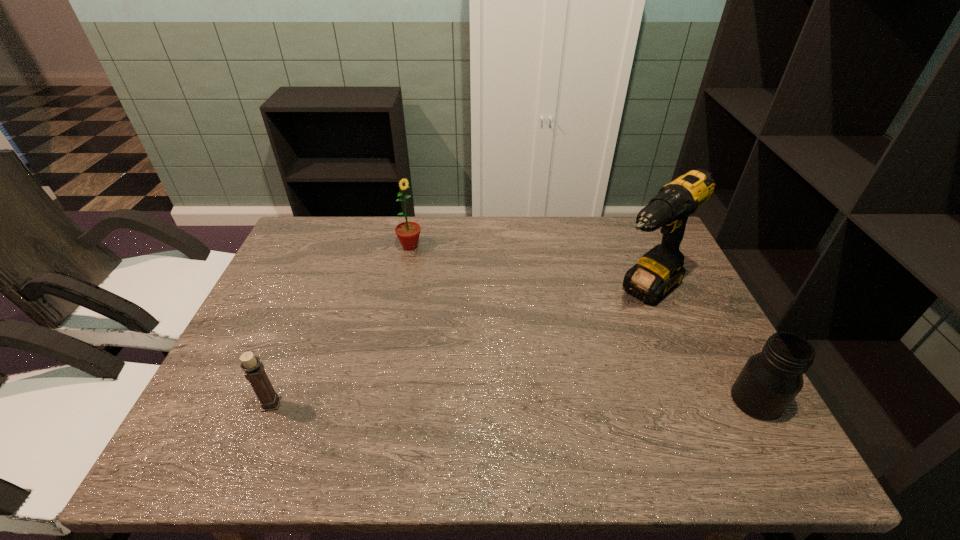
I want to click on candle holder, so click(x=254, y=370).

Locate an element on the screen. jar is located at coordinates (770, 380).

The width and height of the screenshot is (960, 540). I want to click on drill, so click(659, 271).

Where is `the tallest object`? The height and width of the screenshot is (540, 960). the tallest object is located at coordinates pyautogui.click(x=659, y=271).

Where is `sunflower`? The width and height of the screenshot is (960, 540). sunflower is located at coordinates (408, 233).

Find the location of a particular element. The height and width of the screenshot is (540, 960). the farthest object is located at coordinates (408, 233).

Locate an element on the screen. This screenshot has height=540, width=960. free spot located 0.370m on the right of the candle holder is located at coordinates (451, 404).

Find the location of a particular element. vacant space located on the back of the jar is located at coordinates (712, 320).

This screenshot has height=540, width=960. Identify the location of free space located at the tip of the drill. (571, 357).

I want to click on vacant area situated at the tip of the drill, so click(x=545, y=382).